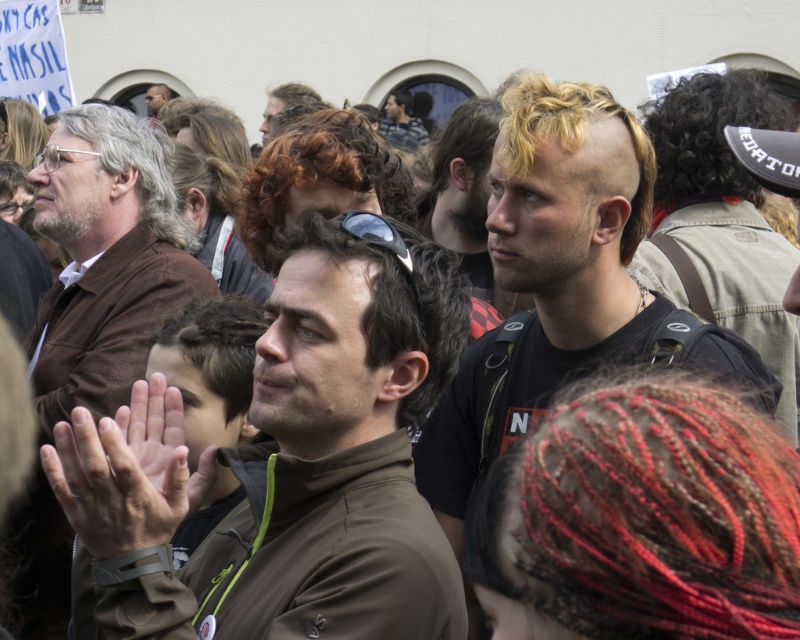
You are a photographer standing at the camera position. You want to capture a closeup shot of the blonde hair at center. Given that your zoom lens can magnify objects up to 20 meters away, will you be able to achieve this?

The distance between the blonde hair at center and the camera is 31.21 meters, which exceeds the zoom lens maximum range of 20 meters. Therefore, you won not be able to capture a closeup shot of the blonde hair at center with the current equipment.

You are a photographer trying to capture a photo of the crowd. You notice the brown matte jacket at center and the matte black jacket at upper center. Which jacket should you focus on to ensure it appears larger in your photo?

The brown matte jacket at center is below the matte black jacket at upper center. Since it is positioned lower, it might appear larger in the photo due to its placement closer to the camera.

You are a photographer standing at the edge of the crowd. You want to capture a photo that includes both the blonde hair at center and the matte brown jacket at left. Given that your camera has a maximum focus range of 10 meters, will you be able to include both subjects in the same frame without moving closer?

The blonde hair at center and the matte brown jacket at left are 12.36 meters apart, which exceeds the camera maximum focus range of 10 meters. Therefore, you cannot include both subjects in the same frame without moving closer.